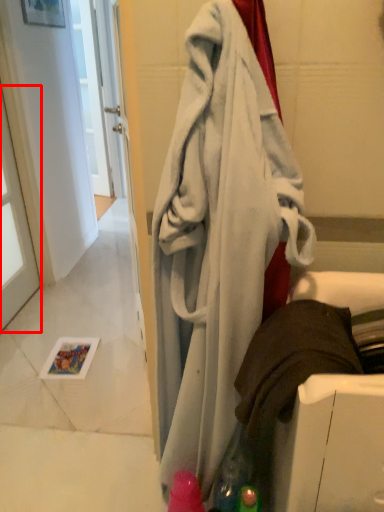
Question: From the image's perspective, what is the correct spatial relationship of window (annotated by the red box) in relation to towel?

Choices:
 (A) above
 (B) below

Answer: (A)